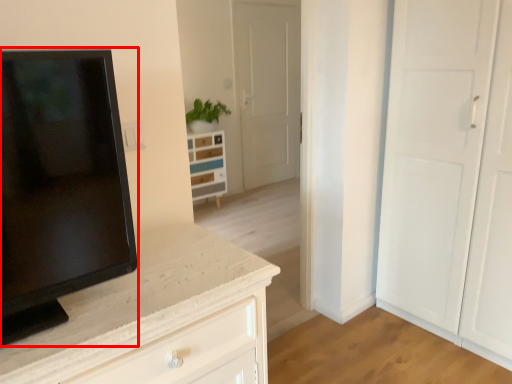
Question: Observing the image, what is the correct spatial positioning of screen (annotated by the red box) in reference to chest of drawers?

Choices:
 (A) left
 (B) right

Answer: (B)